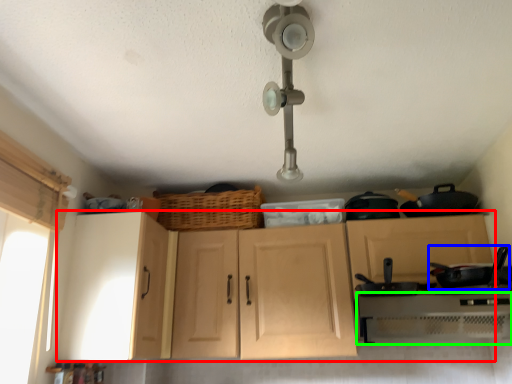
Question: Which object is positioned closest to cabinetry (highlighted by a red box)? Select from frying pan (highlighted by a blue box) and oven (highlighted by a green box).

Choices:
 (A) frying pan
 (B) oven

Answer: (B)